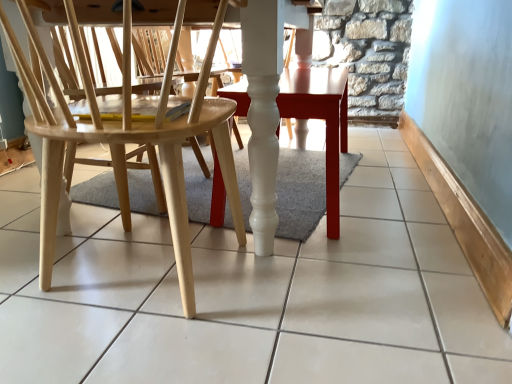
I want to click on free space underneath natural wood chair at left (from a real-world perspective), so click(140, 280).